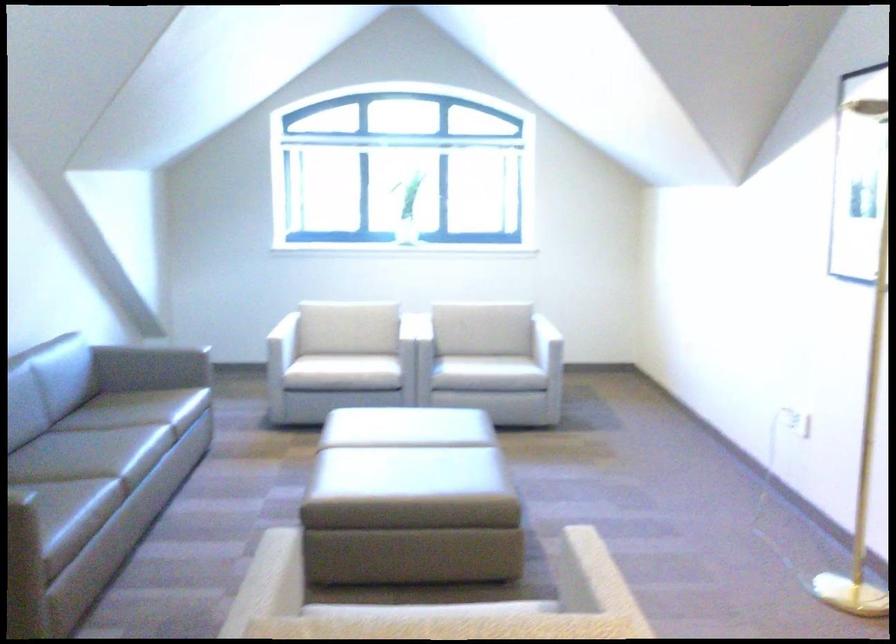
Where would you lean the sofa armrest? Please return your answer as a coordinate pair (x, y).

(156, 342)